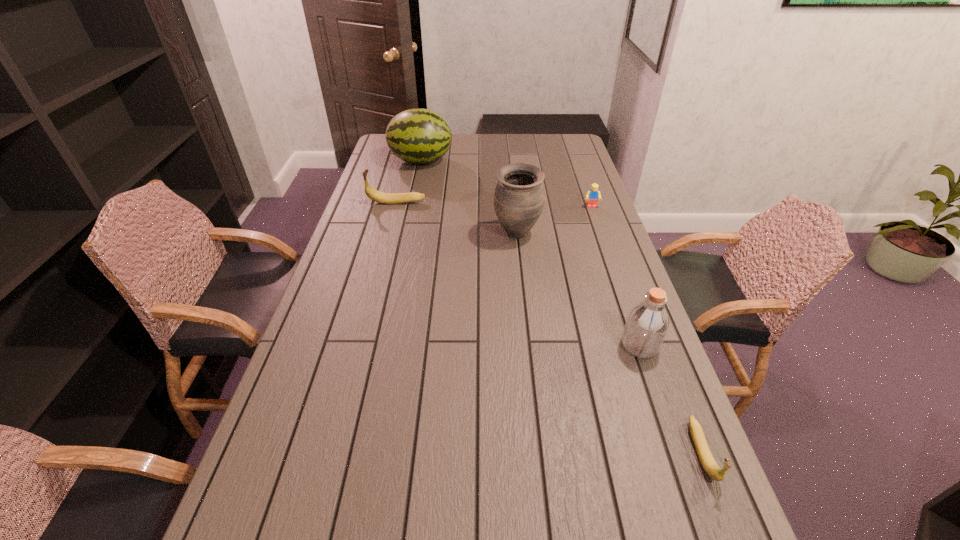
Where is `free space between the Lego and the fourth farthest object`? free space between the Lego and the fourth farthest object is located at coordinates (554, 220).

Where is `empty location between the fourth object from right to left and the taller banana`? empty location between the fourth object from right to left and the taller banana is located at coordinates (457, 218).

The width and height of the screenshot is (960, 540). I want to click on free area in between the taller banana and the watermelon, so click(x=409, y=181).

Locate an element on the screen. Image resolution: width=960 pixels, height=540 pixels. free space between the second nearest object and the Lego is located at coordinates (615, 276).

Point out which object is positioned as the fourth nearest to the nearest object. Please provide its 2D coordinates. Your answer should be formatted as a tuple, i.e. [(x, y)], where the tuple contains the x and y coordinates of a point satisfying the conditions above.

[(388, 198)]

Select which object appears as the third closest to the fourth tallest object. Please provide its 2D coordinates. Your answer should be formatted as a tuple, i.e. [(x, y)], where the tuple contains the x and y coordinates of a point satisfying the conditions above.

[(593, 194)]

At what (x,y) coordinates should I click in order to perform the action: click on vacant region that satisfies the following two spatial constraints: 1. on the back side of the fourth farthest object; 2. at the stem of the left banana. Please return your answer as a coordinate pair (x, y). The image size is (960, 540). Looking at the image, I should click on (514, 202).

At what (x,y) coordinates should I click in order to perform the action: click on free spot that satisfies the following two spatial constraints: 1. at the stem of the third shortest object; 2. on the left side of the urn. Please return your answer as a coordinate pair (x, y). Looking at the image, I should click on (388, 234).

At what (x,y) coordinates should I click in order to perform the action: click on vacant space that satisfies the following two spatial constraints: 1. at the stem of the fourth farthest object; 2. on the left side of the farther banana. Please return your answer as a coordinate pair (x, y). This screenshot has width=960, height=540. Looking at the image, I should click on (388, 234).

Find the location of a particular element. This screenshot has width=960, height=540. free space that satisfies the following two spatial constraints: 1. at the stem end of the farthest object; 2. on the back side of the third nearest object is located at coordinates (405, 234).